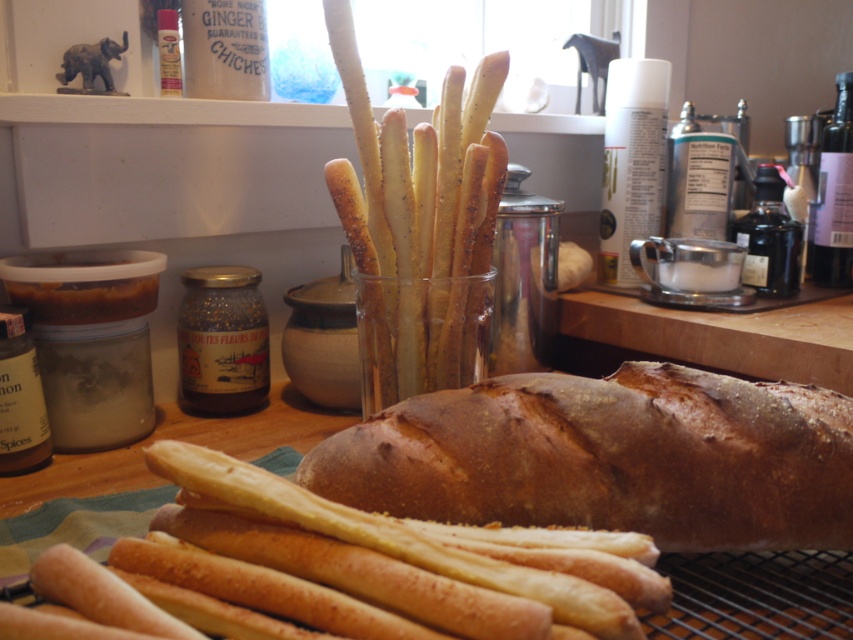
Does golden breadsticks at center have a larger size compared to golden-brown breadsticks at center?

Actually, golden breadsticks at center might be smaller than golden-brown breadsticks at center.

Measure the distance between golden breadsticks at center and golden-brown breadsticks at center.

They are 9.35 inches apart.

Is point (392, 564) closer to camera compared to point (480, 195)?

Yes, point (392, 564) is closer to viewer.

The height and width of the screenshot is (640, 853). I want to click on golden breadsticks at center, so click(x=376, y=564).

Does brown matte bread at center appear on the left side of golden-brown breadsticks at center?

In fact, brown matte bread at center is to the right of golden-brown breadsticks at center.

I want to click on brown matte bread at center, so point(608,458).

Which is more to the right, brown matte bread at center or golden breadsticks at center?

brown matte bread at center is more to the right.

Measure the distance between brown matte bread at center and camera.

They are 35.87 centimeters apart.

This screenshot has width=853, height=640. What do you see at coordinates (608, 458) in the screenshot? I see `brown matte bread at center` at bounding box center [608, 458].

Image resolution: width=853 pixels, height=640 pixels. Identify the location of brown matte bread at center. (608, 458).